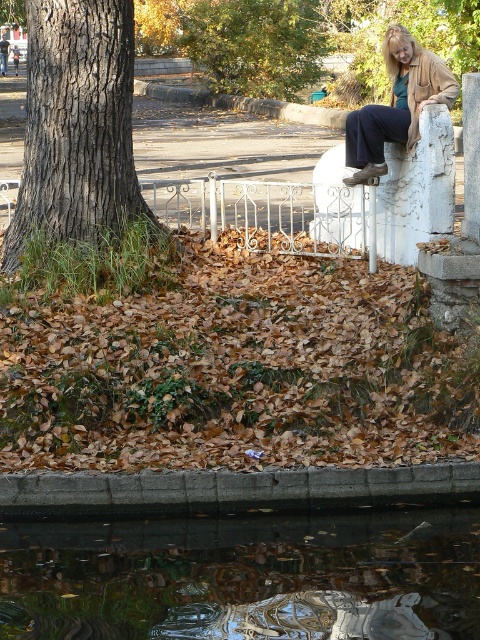
Does gray textured bark at left lie in front of concrete ledge at lower center?

That is False.

Does gray textured bark at left appear over concrete ledge at lower center?

Yes, gray textured bark at left is above concrete ledge at lower center.

You are a GUI agent. You are given a task and a screenshot of the screen. Output one action in this format:
    pyautogui.click(x=<x>, y=<y>)
    Task: Click on the gray textured bark at left
    The height and width of the screenshot is (640, 480).
    Given the screenshot: What is the action you would take?
    pyautogui.click(x=76, y=124)

Is point (140, 592) positioned in front of point (97, 60)?

Yes, it is in front of point (97, 60).

Does reflective glass water at lower center appear on the right side of gray textured bark at left?

Yes, reflective glass water at lower center is to the right of gray textured bark at left.

Who is more forward, (325, 573) or (83, 198)?

Point (325, 573) is in front.

At what (x,y) coordinates should I click in order to perform the action: click on reflective glass water at lower center. Please return your answer as a coordinate pair (x, y). Looking at the image, I should click on (244, 577).

Which is below, gray textured bark at left or matte brown jacket at upper right?

gray textured bark at left is lower down.

Based on the photo, which is above, gray textured bark at left or matte brown jacket at upper right?

matte brown jacket at upper right

This screenshot has width=480, height=640. What do you see at coordinates (76, 124) in the screenshot? I see `gray textured bark at left` at bounding box center [76, 124].

This screenshot has height=640, width=480. Find the location of `gray textured bark at left`. gray textured bark at left is located at coordinates tap(76, 124).